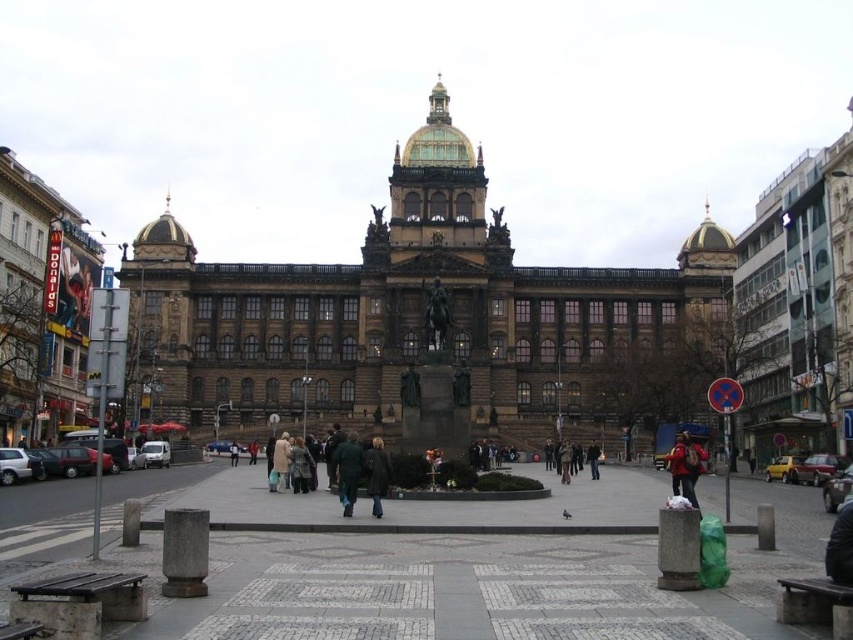
Consider the image. You are a photographer standing in the plaza and want to capture both the red fabric backpack at lower right and the dark brown leather coat at center in the same frame. Considering their sizes, which object will appear bigger in your photo?

The red fabric backpack at lower right will appear bigger in the photo because it has a larger size compared to the dark brown leather coat at center.

You are a photographer trying to capture both the dark green jacket at center and the dark brown leather coat at center in a single frame. Since you want to ensure both are clearly visible, which clothing item should you focus on first to account for their size difference?

The dark green jacket at center is wider than the dark brown leather coat at center, so you should focus on the dark green jacket at center first to ensure its full width is captured in the frame.